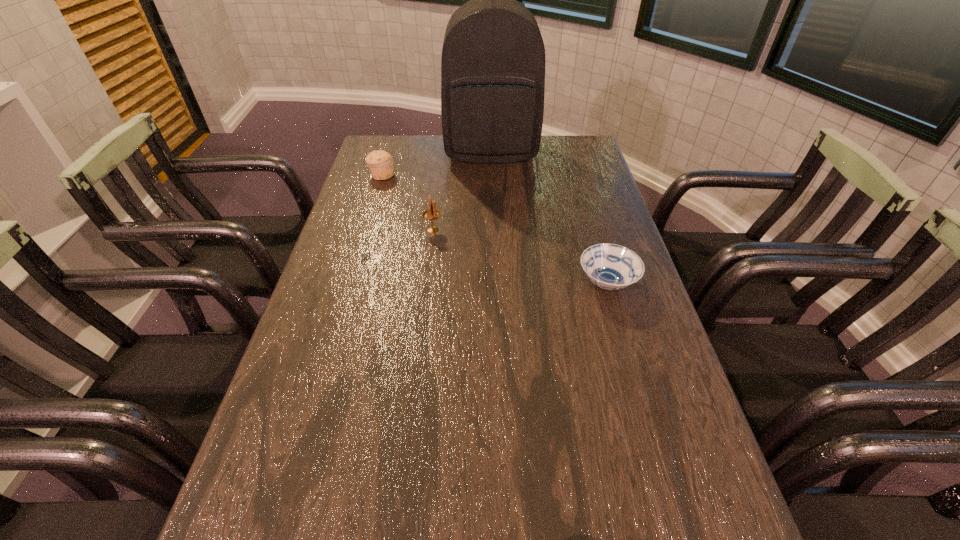
The height and width of the screenshot is (540, 960). What are the coordinates of `backpack` in the screenshot? It's located at (493, 58).

This screenshot has height=540, width=960. Identify the location of the third shortest object. (431, 214).

The height and width of the screenshot is (540, 960). Find the location of `the second nearest object`. the second nearest object is located at coordinates (431, 214).

The height and width of the screenshot is (540, 960). Find the location of `the third tallest object`. the third tallest object is located at coordinates click(380, 162).

You are a GUI agent. You are given a task and a screenshot of the screen. Output one action in this format:
    pyautogui.click(x=<x>, y=<y>)
    Task: Click on the muffin
    The width and height of the screenshot is (960, 540).
    Given the screenshot: What is the action you would take?
    pyautogui.click(x=380, y=162)

Find the location of a particular element. the rightmost object is located at coordinates (610, 266).

Locate an element on the screen. This screenshot has width=960, height=540. the shortest object is located at coordinates (610, 266).

Image resolution: width=960 pixels, height=540 pixels. I want to click on vacant space situated on the front-facing side of the tallest object, so click(x=492, y=183).

This screenshot has height=540, width=960. Identify the location of free region located 0.270m on the back of the candle holder. pyautogui.click(x=440, y=176).

This screenshot has width=960, height=540. What are the coordinates of `free spot located on the right of the second shortest object` in the screenshot? It's located at (427, 175).